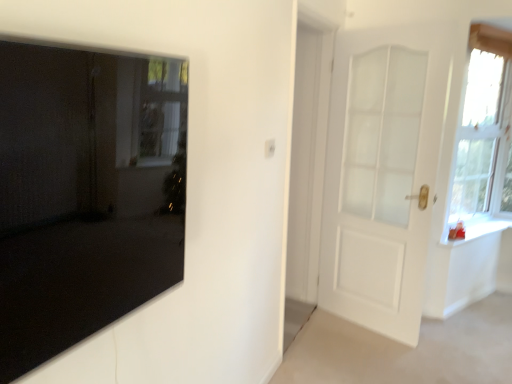
Question: In the image, is white frosted glass window at upper right positioned in front of or behind matte black mirror at left, which is counted as the 2th door, starting from the back?

Choices:
 (A) behind
 (B) front

Answer: (A)

Question: Would you say white frosted glass window at upper right is to the left or to the right of matte black mirror at left, which ranks as the 2th door in right-to-left order, in the picture?

Choices:
 (A) right
 (B) left

Answer: (A)

Question: Estimate the real-world distances between objects in this image. Which object is farther from the white glossy window sill at right?

Choices:
 (A) white matte door at right, the 2th door positioned from the left
 (B) white frosted glass window at upper right
 (C) matte black mirror at left, which is counted as the 2th door, starting from the back

Answer: (C)

Question: Which of these objects is positioned farthest from the white matte door at right, the first door in the back-to-front sequence?

Choices:
 (A) white frosted glass window at upper right
 (B) matte black mirror at left, which is the first door in left-to-right order
 (C) white glossy window sill at right

Answer: (B)